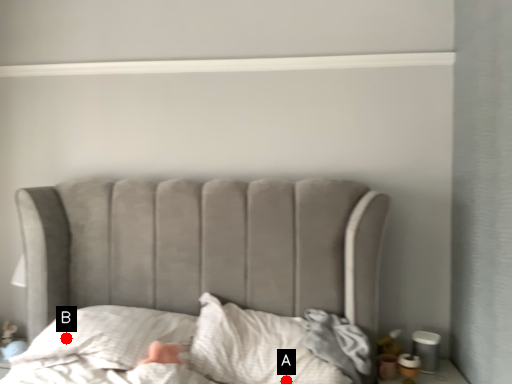
Question: Two points are circled on the image, labeled by A and B beside each circle. Among these points, which one is farthest from the camera?

Choices:
 (A) A is further
 (B) B is further

Answer: (B)